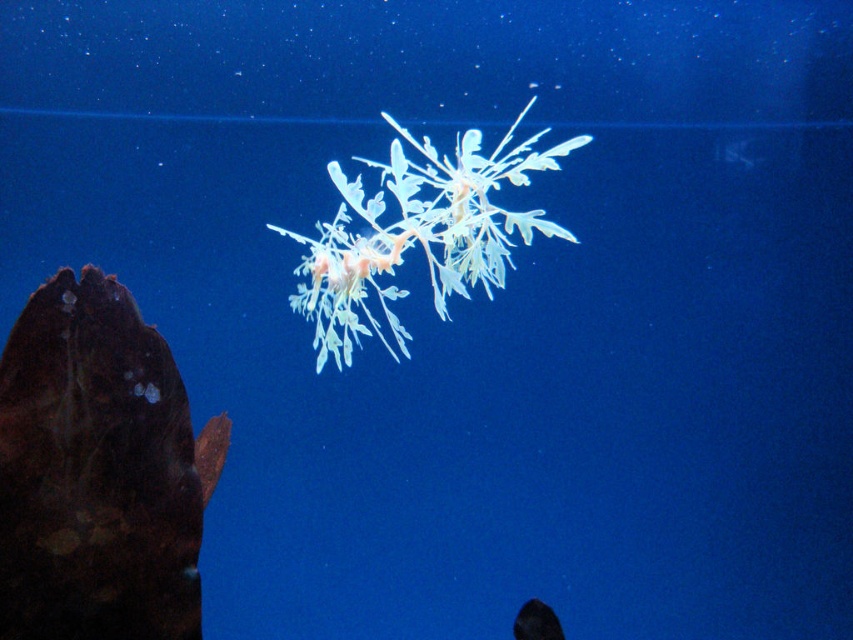
You are an underwater photographer aiming to capture both the brown matte fish at left and the translucent white leaf at center in a single frame. Considering their sizes and positions, which one will appear larger in your photo?

The brown matte fish at left is much taller than the translucent white leaf at center, so it will appear larger in the photo.